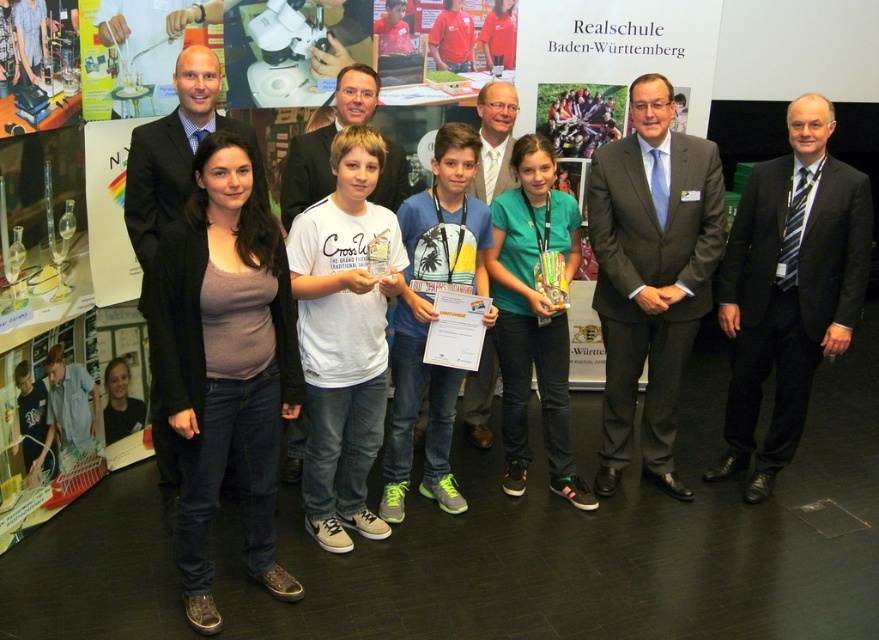
Question: From the image, what is the correct spatial relationship of black suit at right in relation to dark gray suit at center?

Choices:
 (A) below
 (B) above

Answer: (A)

Question: Is matte black suit at left thinner than white cotton t-shirt at center?

Choices:
 (A) no
 (B) yes

Answer: (A)

Question: Which point is farther to the camera?

Choices:
 (A) [x=481, y=157]
 (B) [x=149, y=148]

Answer: (A)

Question: Can you confirm if black suit at right is positioned to the left of matte gray suit at center?

Choices:
 (A) yes
 (B) no

Answer: (B)

Question: Which object is positioned farthest from the dark gray suit at center?

Choices:
 (A) matte gray suit at center
 (B) white cotton t-shirt at center

Answer: (B)

Question: Which of the following is the closest to the observer?

Choices:
 (A) white cotton t-shirt at center
 (B) black suit at right
 (C) dark gray suit at center
 (D) matte gray suit at center

Answer: (B)